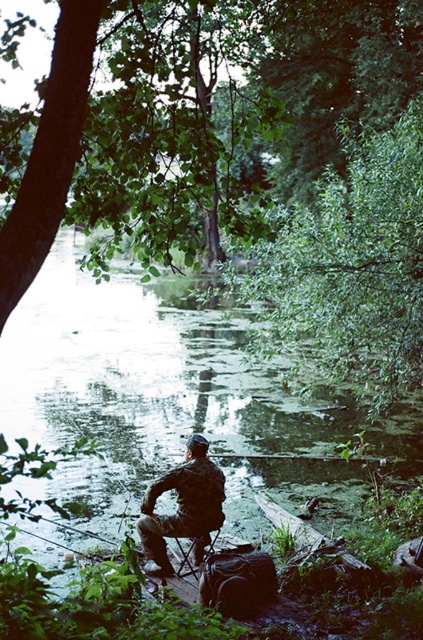
You are a photographer planning to take a picture of the green leafy tree at upper center and the metallic folding chair at center. Which object should you focus on first if you want to capture both in a single frame without moving the camera?

The green leafy tree at upper center is larger in size than the metallic folding chair at center, so you should focus on the larger object first to ensure it fills the frame appropriately while still capturing the smaller metallic folding chair at center in the same shot.

You are a photographer trying to capture the entire scene in one shot. Given that the green leafy tree at upper left and the camouflage fabric fisherman at center are both in your frame, which object would appear larger in your photo?

The green leafy tree at upper left would appear larger in the photo because it is bigger than the camouflage fabric fisherman at center according to the description.

You are a drone operator trying to capture a photo of the green leafy tree at upper center. The camera is currently positioned at point 0.422, 0.825. Is the camera already aligned to capture the tree?

The position of green leafy tree at upper center is at point (348, 269), so yes, the camera is already aligned to capture the tree since it is positioned exactly at those coordinates.